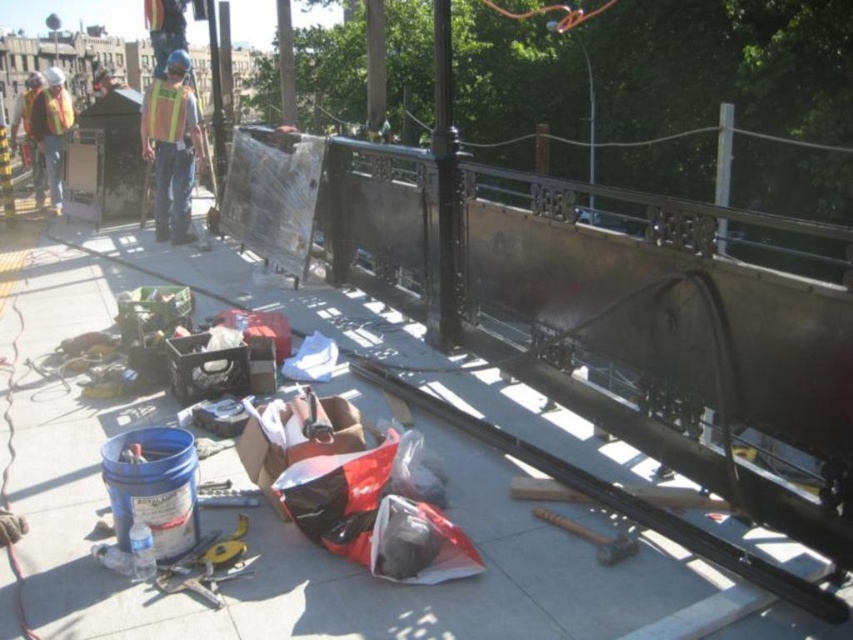
You are a safety inspector checking the construction site. You notice two safety vests on the ground. The yellow reflective vest at center and the reflective safety vest at left. Which one is narrower in width?

The yellow reflective vest at center is thinner than the reflective safety vest at left, so the yellow reflective vest at center is narrower in width.

You are a construction worker who needs to carry both the plastic bucket at lower left and the yellow reflective vest at center to the other side of the site. Given their sizes, which item should you pick up first to ensure you can carry both comfortably?

The plastic bucket at lower left is larger in size than the yellow reflective vest at center, so you should pick up the plastic bucket at lower left first to ensure you can carry both comfortably.

You are a worker on the construction site and need to place a heavy object on the ground. Which location would be more stable, the metallic gray pavement at center or the plastic bucket at lower left?

The metallic gray pavement at center is more stable because it is a solid surface, while the plastic bucket at lower left is an object that can easily be moved or overturned.